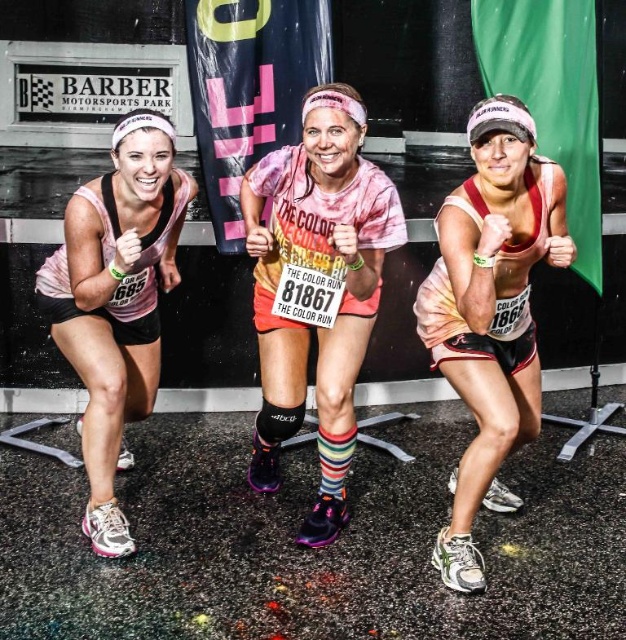
Question: Is the position of multicolored striped socks at center less distant than that of pink tie-dye tank top at left?

Choices:
 (A) yes
 (B) no

Answer: (A)

Question: Based on their relative distances, which object is farther from the matte tie-dye tank top at center?

Choices:
 (A) pink tie-dye tank top at left
 (B) multicolored striped socks at center

Answer: (A)

Question: Estimate the real-world distances between objects in this image. Which object is closer to the multicolored striped socks at center?

Choices:
 (A) pink tie-dye tank top at left
 (B) matte tie-dye tank top at center

Answer: (B)

Question: Does matte tie-dye tank top at center appear over pink tie-dye tank top at left?

Choices:
 (A) yes
 (B) no

Answer: (B)

Question: Considering the relative positions of matte tie-dye tank top at center and multicolored striped socks at center in the image provided, where is matte tie-dye tank top at center located with respect to multicolored striped socks at center?

Choices:
 (A) above
 (B) below

Answer: (B)

Question: Which of these objects is positioned farthest from the multicolored striped socks at center?

Choices:
 (A) pink tie-dye tank top at left
 (B) matte tie-dye tank top at center

Answer: (A)